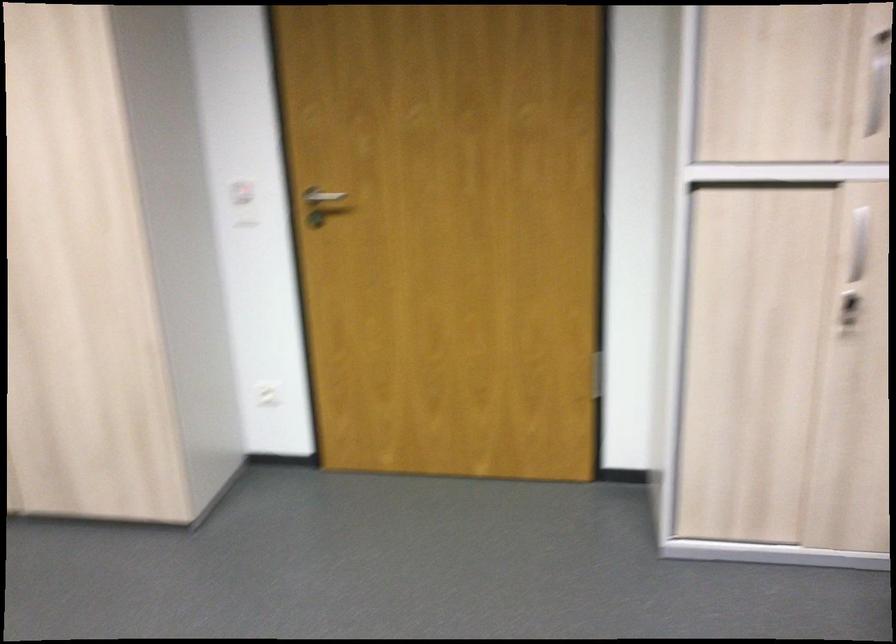
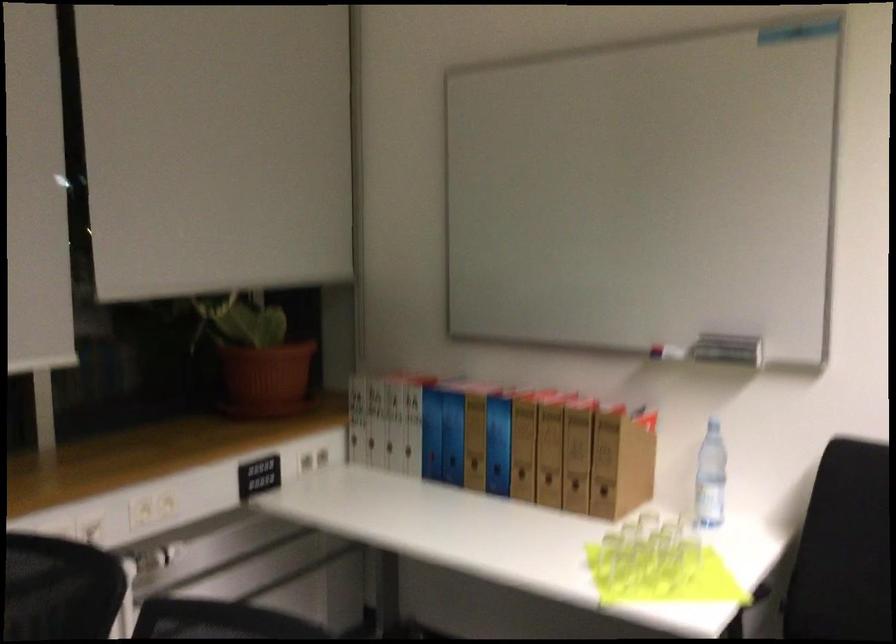
The first image is from the beginning of the video and the second image is from the end. How did the camera likely rotate when shooting the video?

The rotation direction of the camera is left-down.